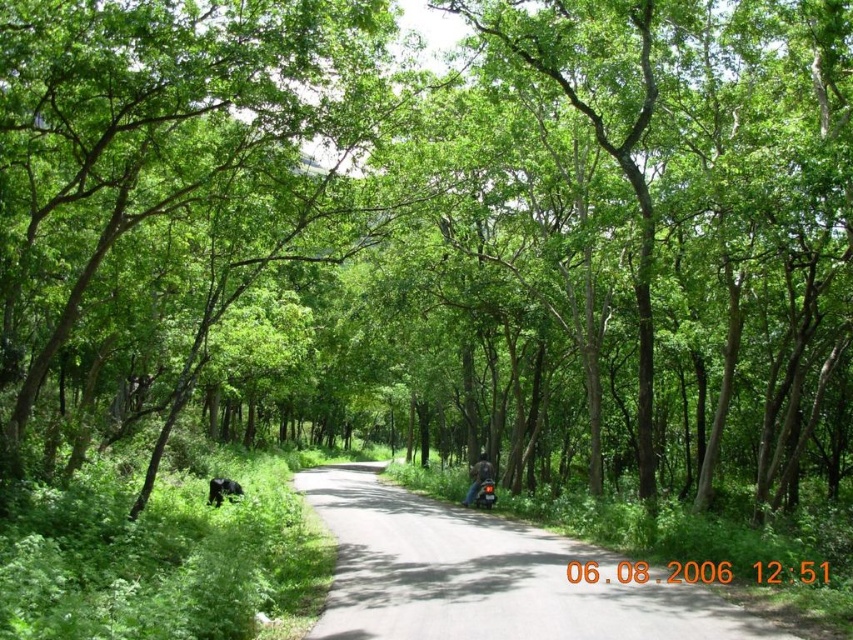
You are a pedestrian standing on the road and see the leather jacket at center and the shiny black motorcycle at center. Which object is closer to you?

The leather jacket at center is closer to you because it is further to the viewer than the shiny black motorcycle at center.

You are a photographer standing on the left side of the road in the forest scene. You want to take a photo of the leather jacket at center and the shiny black motorcycle at center so that both are clearly visible in the frame. Given their distance apart, can you estimate if they will both fit within a standard camera frame that has a 50cm width?

The leather jacket at center and shiny black motorcycle at center are 20.57 inches apart. Since 20.57 inches is approximately 52.24 cm, which exceeds the 50cm width of the standard camera frame, they might not both fit within the frame.

You are a hiker lost in the forest and see the asphalt road at center and the leather jacket at center. Which object is closer to you?

The asphalt road at center is positioned over the leather jacket at center, so the asphalt road at center is closer to you.